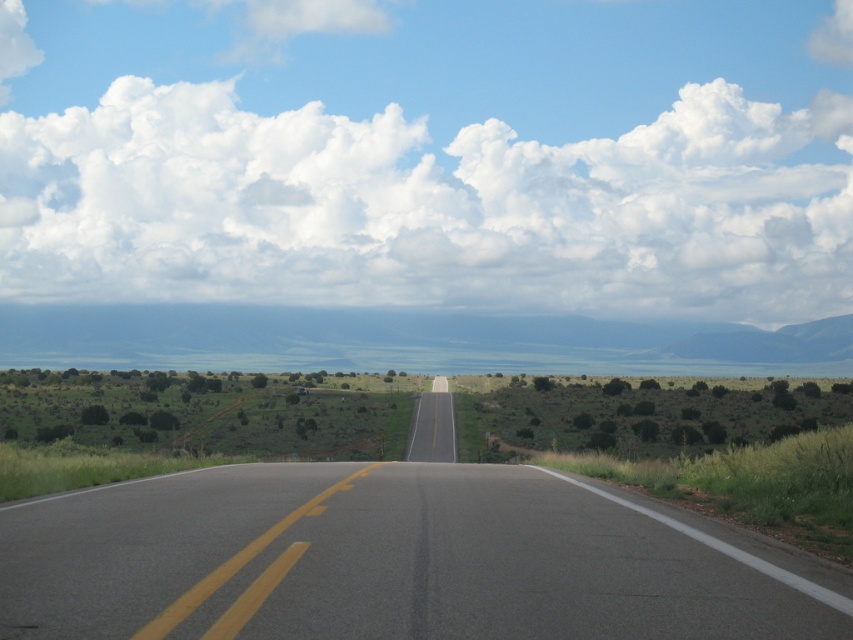
You are a hiker trying to cross the green grassland at center and the asphalt road at center. Which path has a bigger area to walk on?

The green grassland at center has a larger size compared to the asphalt road at center, so the green grassland at center has a bigger area to walk on.

You are standing at the starting point of the road and want to walk towards the green grassland at center. Which direction should you walk?

You should walk forward along the road since the green grassland at center is located at point (405, 340), which is directly ahead on the path.